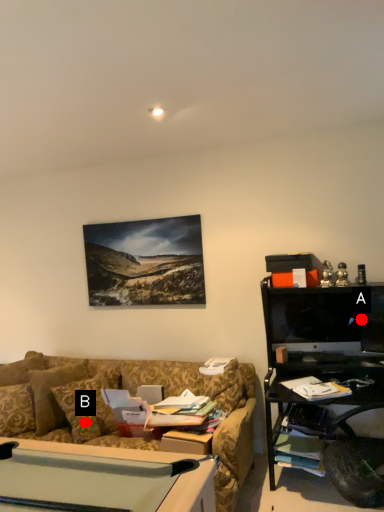
Question: Two points are circled on the image, labeled by A and B beside each circle. Which of the following is the closest to the observer?

Choices:
 (A) A is closer
 (B) B is closer

Answer: (B)